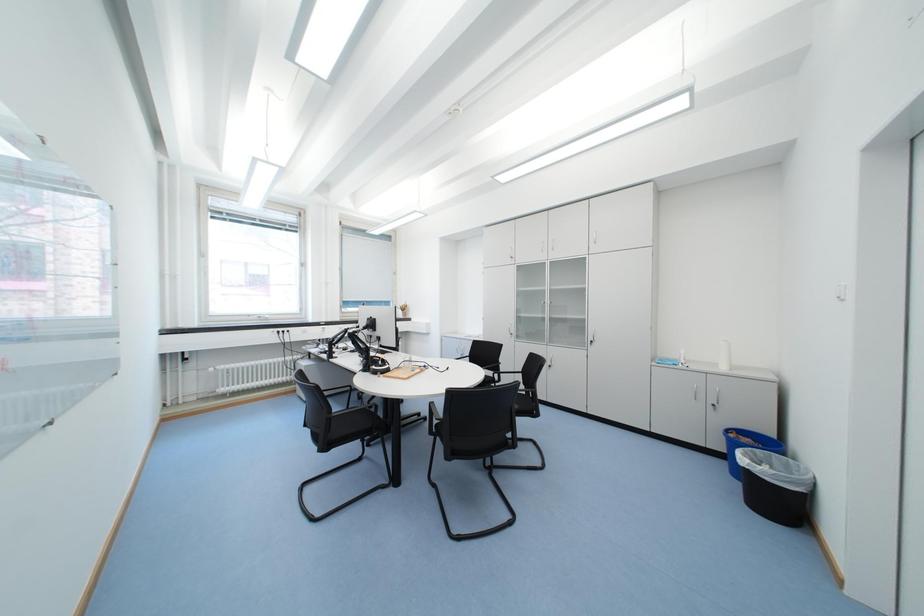
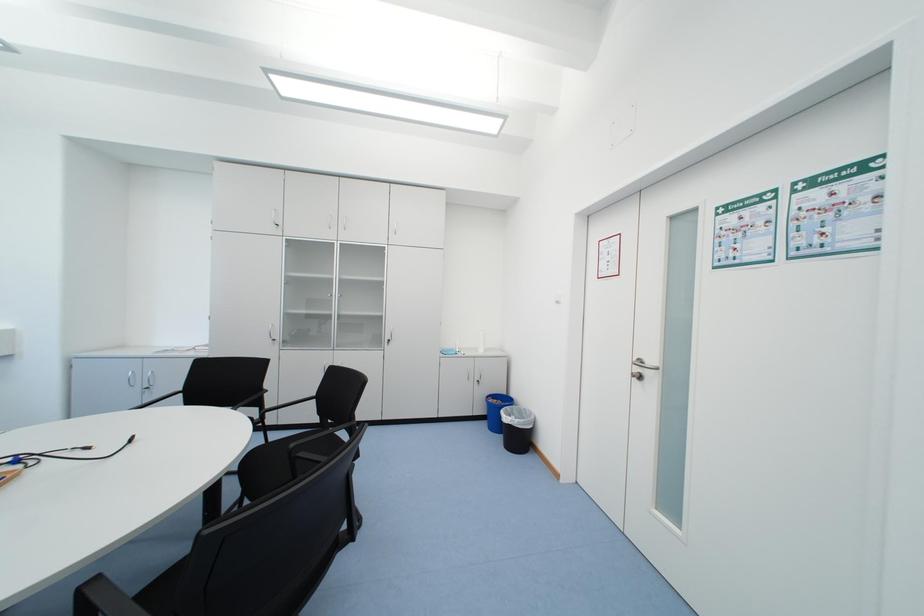
Question: The camera is either moving clockwise (left) or counter-clockwise (right) around the object. The first image is from the beginning of the video and the second image is from the end. Is the camera moving left or right when shooting the video?

Choices:
 (A) Left
 (B) Right

Answer: (A)